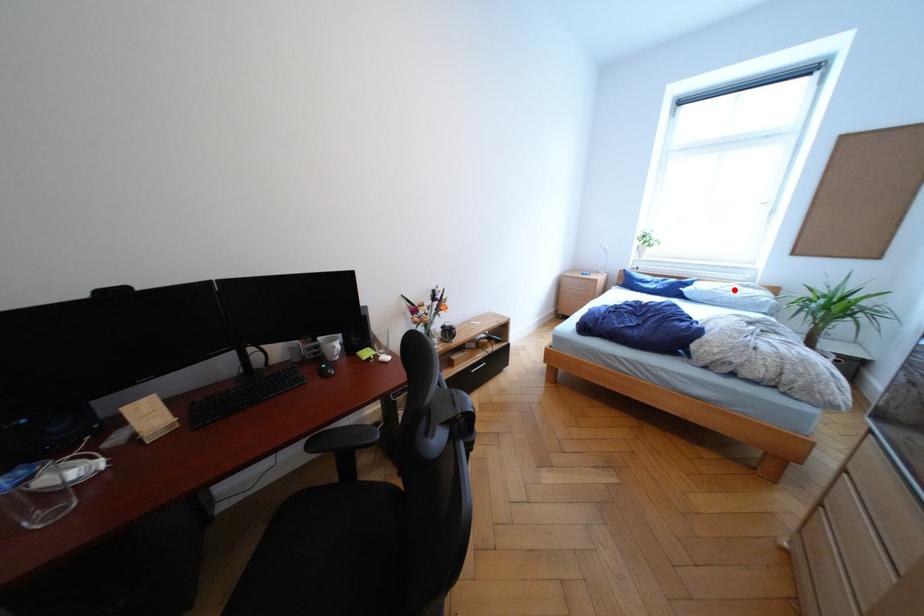
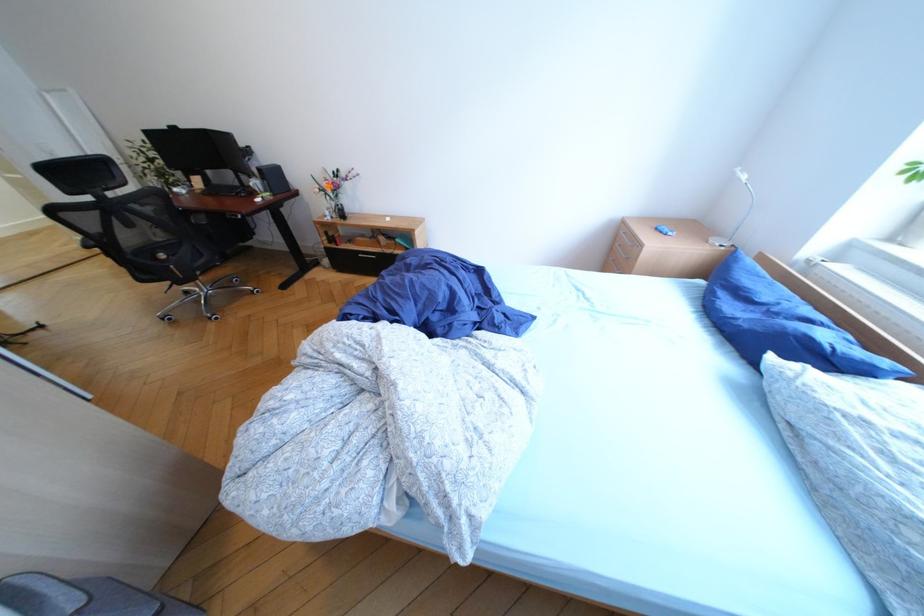
The point at the highlighted location is marked in the first image. Where is the corresponding point in the second image?

(912, 448)